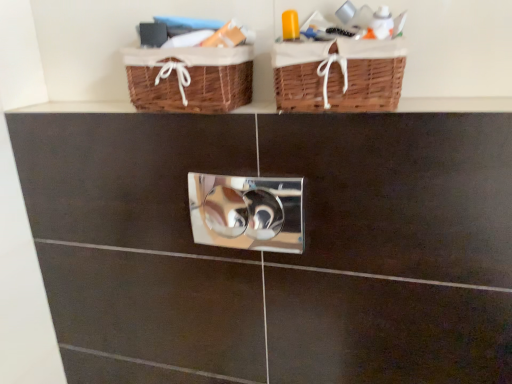
You are a GUI agent. You are given a task and a screenshot of the screen. Output one action in this format:
    pyautogui.click(x=<x>, y=<y>)
    Task: Click on the free location above woven brown basket at upper center, which appears as the first basket when viewed from the right (from a real-world perspective)
    This screenshot has height=384, width=512.
    Given the screenshot: What is the action you would take?
    pyautogui.click(x=342, y=34)